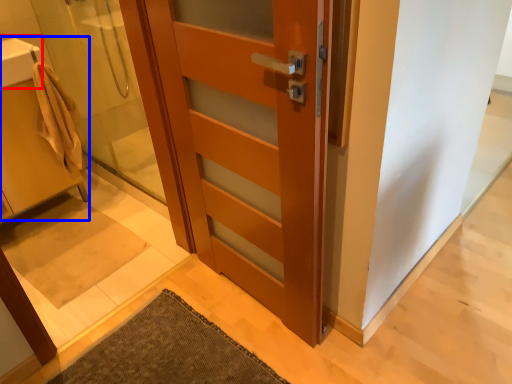
Question: Which of the following is the farthest to the observer, sink (highlighted by a red box) or sink (highlighted by a blue box)?

Choices:
 (A) sink
 (B) sink

Answer: (A)